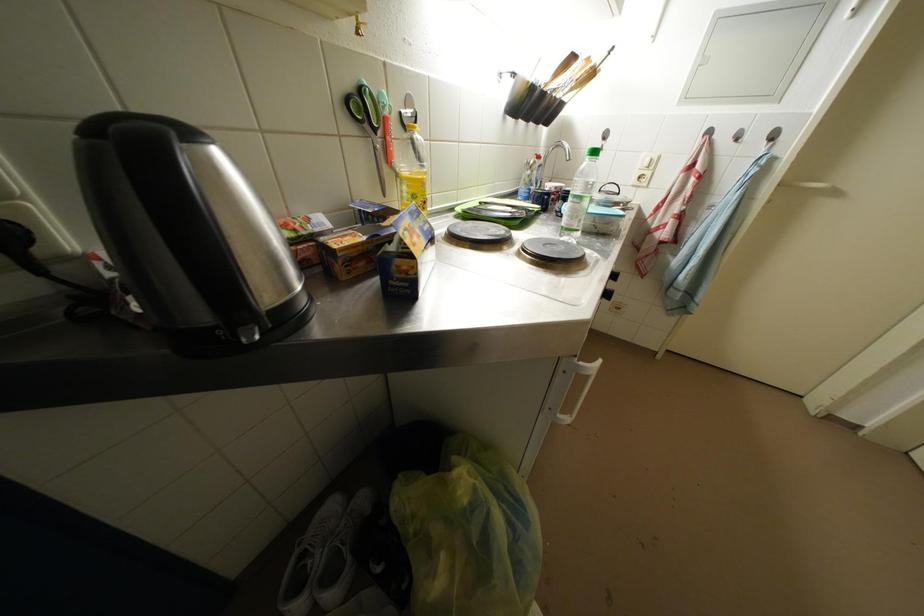
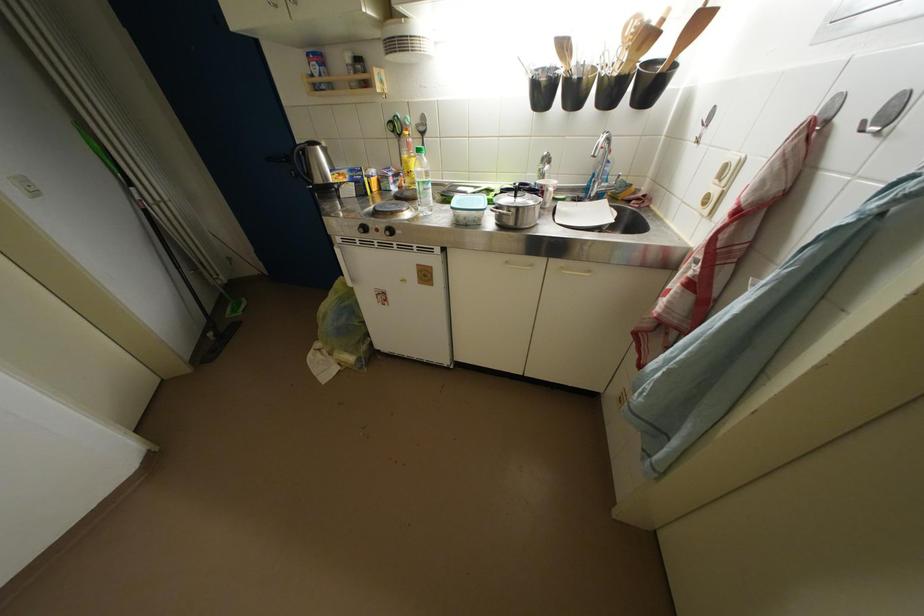
Find the pixel in the second image that matches pixel 430 188 in the first image.

(412, 167)